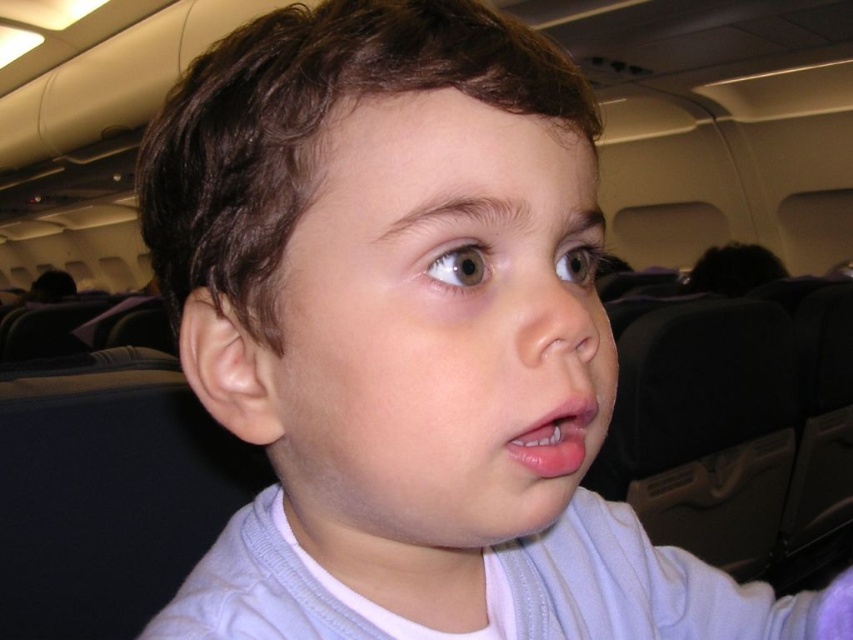
Who is shorter, smooth skin nose at center or pink glossy lips at center?

pink glossy lips at center is shorter.

Between point (593, 328) and point (572, 412), which one is positioned behind?

Positioned behind is point (593, 328).

Which is in front, point (587, 284) or point (544, 461)?

Point (544, 461) is more forward.

Locate an element on the screen. smooth skin nose at center is located at coordinates (563, 312).